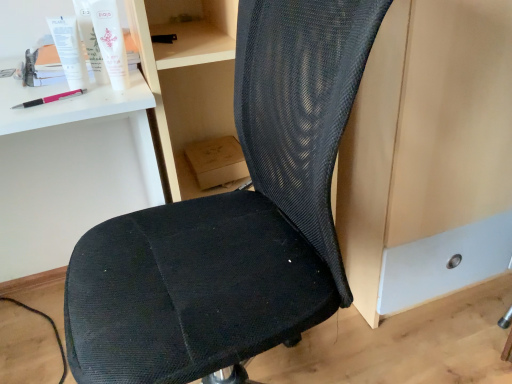
Question: From a real-world perspective, is white matte tube at upper left, the second toiletry when ordered from right to left, under white plastic tube at upper left?

Choices:
 (A) yes
 (B) no

Answer: (B)

Question: Can you confirm if white matte tube at upper left, the second toiletry when ordered from right to left, is thinner than white plastic tube at upper left?

Choices:
 (A) no
 (B) yes

Answer: (B)

Question: Could you tell me if white matte tube at upper left, the second toiletry when ordered from right to left, is turned towards white plastic tube at upper left?

Choices:
 (A) no
 (B) yes

Answer: (B)

Question: Does white matte tube at upper left, the second toiletry when ordered from right to left, have a greater height compared to white plastic tube at upper left?

Choices:
 (A) yes
 (B) no

Answer: (A)

Question: Does white matte tube at upper left, which is counted as the first toiletry, starting from the left, appear on the left side of white plastic tube at upper left?

Choices:
 (A) no
 (B) yes

Answer: (A)

Question: Would you consider white matte tube at upper left, which is counted as the first toiletry, starting from the left, to be distant from white plastic tube at upper left?

Choices:
 (A) no
 (B) yes

Answer: (A)

Question: Is white matte desk at upper left further to camera compared to white matte tube at upper left, the second toiletry when ordered from right to left?

Choices:
 (A) yes
 (B) no

Answer: (B)

Question: Does white matte desk at upper left have a lesser height compared to white matte tube at upper left, which is counted as the first toiletry, starting from the left?

Choices:
 (A) yes
 (B) no

Answer: (B)

Question: Is white matte desk at upper left smaller than white matte tube at upper left, the second toiletry when ordered from right to left?

Choices:
 (A) no
 (B) yes

Answer: (A)

Question: Can you confirm if white matte desk at upper left is wider than white matte tube at upper left, which is counted as the first toiletry, starting from the left?

Choices:
 (A) no
 (B) yes

Answer: (B)

Question: Is white matte desk at upper left not near white matte tube at upper left, the second toiletry when ordered from right to left?

Choices:
 (A) no
 (B) yes

Answer: (A)

Question: Is white matte desk at upper left directly adjacent to white matte tube at upper left, the second toiletry when ordered from right to left?

Choices:
 (A) yes
 (B) no

Answer: (B)

Question: Is white matte desk at upper left not inside pink plastic pen at upper left?

Choices:
 (A) yes
 (B) no

Answer: (A)